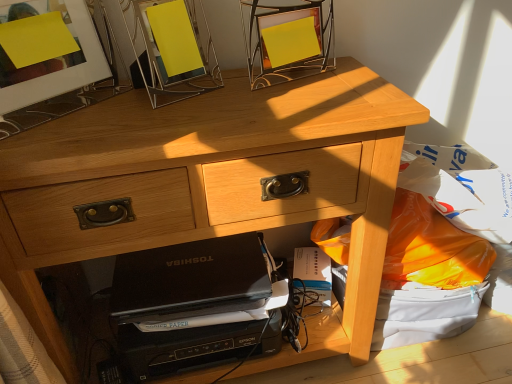
Question: Does matte glass picture frame at upper left, acting as the 2th picture frame starting from the right, lie in front of black matte laptop at lower center?

Choices:
 (A) no
 (B) yes

Answer: (B)

Question: Is matte glass picture frame at upper left, the first picture frame in the left-to-right sequence, surrounding black matte laptop at lower center?

Choices:
 (A) yes
 (B) no

Answer: (B)

Question: Can you confirm if matte glass picture frame at upper left, acting as the 2th picture frame starting from the right, is shorter than black matte laptop at lower center?

Choices:
 (A) yes
 (B) no

Answer: (B)

Question: From the image's perspective, would you say matte glass picture frame at upper left, the first picture frame in the left-to-right sequence, is positioned over black matte laptop at lower center?

Choices:
 (A) yes
 (B) no

Answer: (A)

Question: Considering the relative sizes of matte glass picture frame at upper left, acting as the 2th picture frame starting from the right, and black matte laptop at lower center in the image provided, is matte glass picture frame at upper left, acting as the 2th picture frame starting from the right, bigger than black matte laptop at lower center?

Choices:
 (A) no
 (B) yes

Answer: (B)

Question: Considering the relative sizes of matte glass picture frame at upper left, the first picture frame in the left-to-right sequence, and black matte laptop at lower center in the image provided, is matte glass picture frame at upper left, the first picture frame in the left-to-right sequence, thinner than black matte laptop at lower center?

Choices:
 (A) yes
 (B) no

Answer: (A)

Question: Is matte glass picture frame at upper left, the first picture frame in the left-to-right sequence, facing towards light wood desk at center?

Choices:
 (A) no
 (B) yes

Answer: (A)

Question: Considering the relative positions of matte glass picture frame at upper left, the first picture frame in the left-to-right sequence, and light wood desk at center in the image provided, is matte glass picture frame at upper left, the first picture frame in the left-to-right sequence, to the right of light wood desk at center from the viewer's perspective?

Choices:
 (A) yes
 (B) no

Answer: (B)

Question: Considering the relative sizes of matte glass picture frame at upper left, acting as the 2th picture frame starting from the right, and light wood desk at center in the image provided, is matte glass picture frame at upper left, acting as the 2th picture frame starting from the right, bigger than light wood desk at center?

Choices:
 (A) yes
 (B) no

Answer: (B)

Question: Is matte glass picture frame at upper left, acting as the 2th picture frame starting from the right, to the left of light wood desk at center from the viewer's perspective?

Choices:
 (A) no
 (B) yes

Answer: (B)

Question: Considering the relative sizes of matte glass picture frame at upper left, the first picture frame in the left-to-right sequence, and light wood desk at center in the image provided, is matte glass picture frame at upper left, the first picture frame in the left-to-right sequence, wider than light wood desk at center?

Choices:
 (A) no
 (B) yes

Answer: (A)

Question: Does matte glass picture frame at upper left, the first picture frame in the left-to-right sequence, come in front of light wood desk at center?

Choices:
 (A) no
 (B) yes

Answer: (B)

Question: From the image's perspective, is white paper at lower center beneath metallic silver picture frame at upper center, marked as the 1th picture frame in a right-to-left arrangement?

Choices:
 (A) yes
 (B) no

Answer: (A)